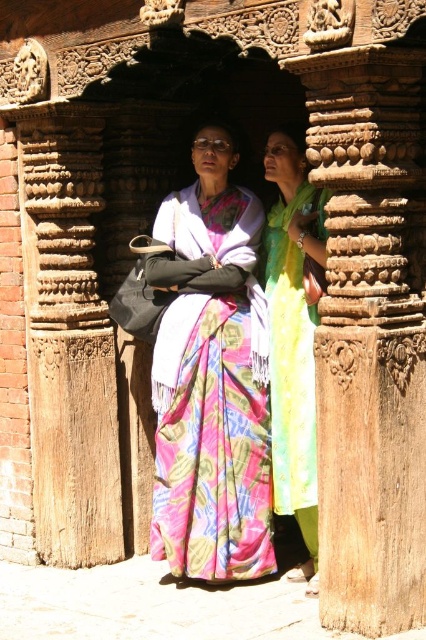
Question: Is printed silk sari at center positioned at the back of green silk dress at center?

Choices:
 (A) yes
 (B) no

Answer: (A)

Question: Which of the following is the closest to the observer?

Choices:
 (A) printed silk sari at center
 (B) green silk dress at center

Answer: (B)

Question: Does printed silk sari at center have a larger size compared to green silk dress at center?

Choices:
 (A) yes
 (B) no

Answer: (A)

Question: Which of the following is the farthest from the observer?

Choices:
 (A) printed silk sari at center
 (B) green silk dress at center

Answer: (A)

Question: Can you confirm if printed silk sari at center is positioned above green silk dress at center?

Choices:
 (A) no
 (B) yes

Answer: (B)